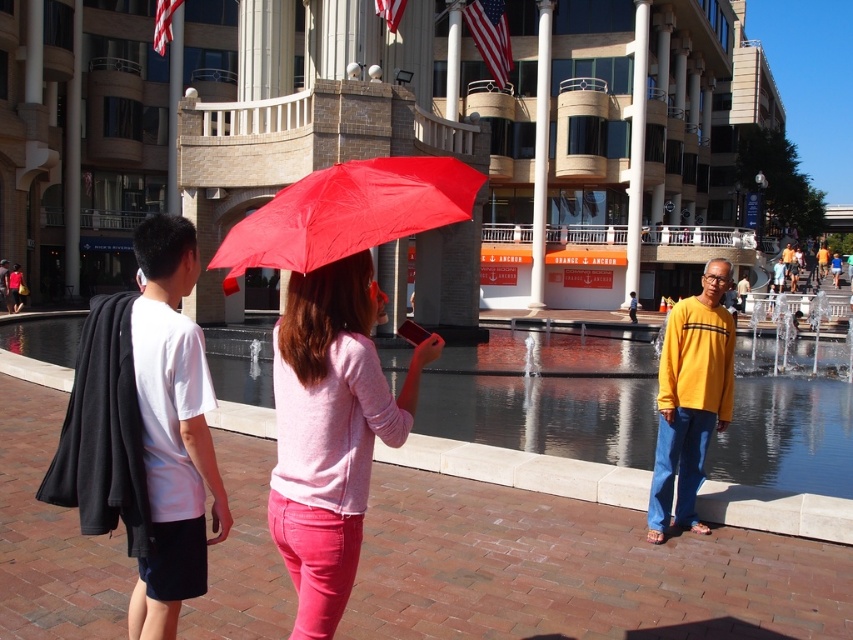
Question: Which object appears farthest from the camera in this image?

Choices:
 (A) yellow long-sleeve shirt at center
 (B) matte black jacket at left
 (C) pink matte sweater at center

Answer: (B)

Question: Does white matte t-shirt at center have a larger size compared to pink matte sweater at center?

Choices:
 (A) no
 (B) yes

Answer: (A)

Question: Does red matte umbrella at center have a lesser width compared to matte black jacket at left?

Choices:
 (A) yes
 (B) no

Answer: (A)

Question: Which point appears closest to the camera in this image?

Choices:
 (A) [322, 218]
 (B) [844, 246]
 (C) [171, 492]

Answer: (A)

Question: Among these points, which one is nearest to the camera?

Choices:
 (A) (654, 506)
 (B) (328, 211)
 (C) (329, 349)
 (D) (6, 308)

Answer: (C)

Question: Does white matte t-shirt at center appear over pink matte sweater at center?

Choices:
 (A) yes
 (B) no

Answer: (A)